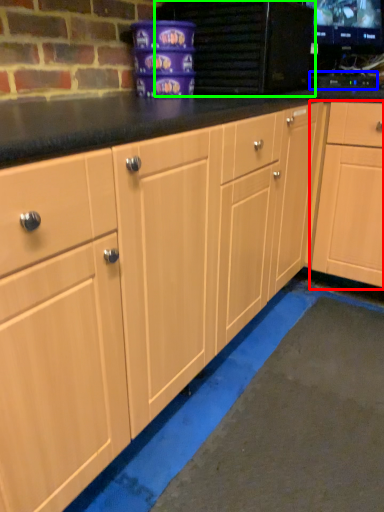
Question: Which object is the farthest from cabinetry (highlighted by a red box)? Choose among these: appliance (highlighted by a blue box) or appliance (highlighted by a green box).

Choices:
 (A) appliance
 (B) appliance

Answer: (B)